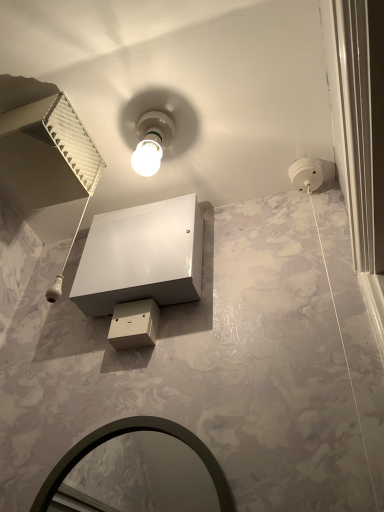
Question: Based on their positions, is white glossy vanity at center located to the left or right of white glossy bulb at upper center?

Choices:
 (A) left
 (B) right

Answer: (A)

Question: From a real-world perspective, relative to white glossy bulb at upper center, is white glossy vanity at center vertically above or below?

Choices:
 (A) below
 (B) above

Answer: (A)

Question: Which of these objects is positioned closest to the white glossy bulb at upper center?

Choices:
 (A) white glossy vanity at center
 (B) matte black mirror at lower center

Answer: (A)

Question: Based on their relative distances, which object is farther from the white glossy bulb at upper center?

Choices:
 (A) matte black mirror at lower center
 (B) white glossy vanity at center

Answer: (A)